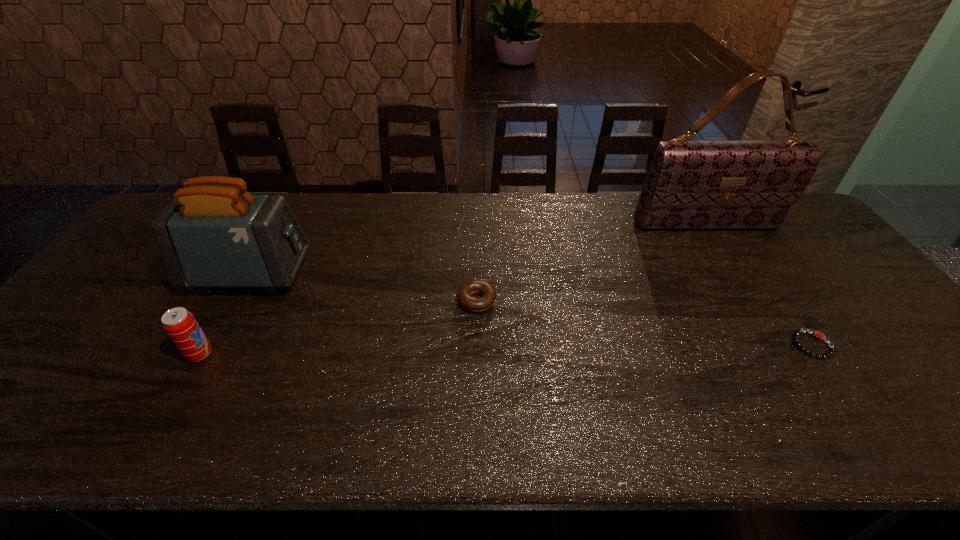
Find the location of `the tallest object`. the tallest object is located at coordinates coord(690,184).

Identify the location of handbag. The height and width of the screenshot is (540, 960). (690, 184).

At what (x,y) coordinates should I click in order to perform the action: click on the fourth shortest object. Please return your answer as a coordinate pair (x, y). The height and width of the screenshot is (540, 960). Looking at the image, I should click on (213, 234).

Where is `soda can`? soda can is located at coordinates (180, 325).

This screenshot has width=960, height=540. What are the coordinates of `doughnut` in the screenshot? It's located at (465, 292).

Where is `the fourth tallest object`? the fourth tallest object is located at coordinates (465, 292).

Locate an element on the screen. the shortest object is located at coordinates 817,334.

Find the location of a particular element. This screenshot has width=960, height=540. vacant space situated on the front of the tallest object with the clasp is located at coordinates (762, 317).

Locate an element on the screen. This screenshot has width=960, height=540. vacant space located on the front-facing side of the toaster is located at coordinates (420, 276).

Locate an element on the screen. The image size is (960, 540). free space located on the back of the soda can is located at coordinates (220, 320).